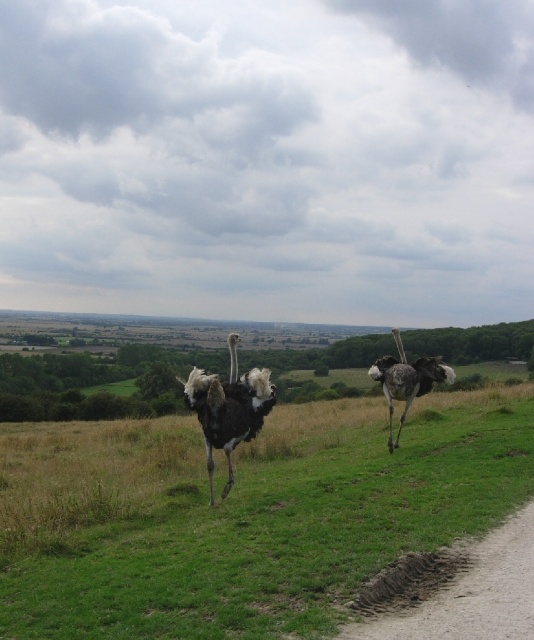
You are a wildlife photographer trying to capture a photo of both the black feathered ostrich at center and the dark grey feathered ostrich at right. Based on their sizes in the image, which ostrich appears smaller?

The black feathered ostrich at center appears smaller because it is thinner than the dark grey feathered ostrich at right.

You are an ornithologist observing two ostriches in a rural landscape. You notice the green grassy at center and the dark grey feathered ostrich at right. Which object is located to the left of the other?

The green grassy at center is positioned on the left side of dark grey feathered ostrich at right, so the green grassy at center is to the left of the dark grey feathered ostrich at right.